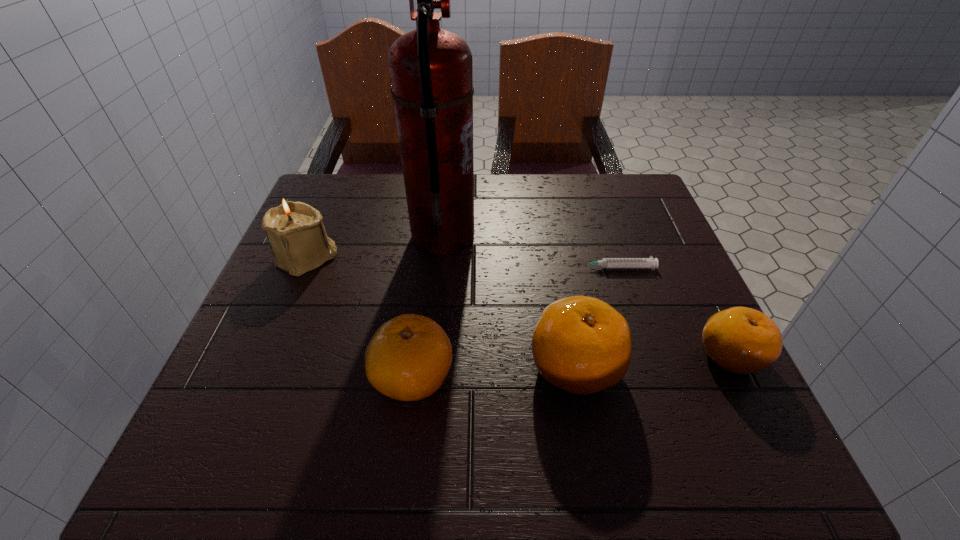
I want to click on vacant region located 0.080m on the left of the second clementine from right to left, so click(x=484, y=366).

The height and width of the screenshot is (540, 960). I want to click on free space located 0.060m on the left of the rightmost object, so click(x=665, y=356).

Locate an element on the screen. The height and width of the screenshot is (540, 960). vacant region located on the nozzle side of the fire extinguisher is located at coordinates (575, 237).

The height and width of the screenshot is (540, 960). I want to click on vacant space located on the back of the fifth shortest object, so click(x=339, y=183).

The height and width of the screenshot is (540, 960). I want to click on vacant space situated at the needle end of the shortest object, so click(x=463, y=268).

Where is `vacant area situated 0.120m at the needle end of the shortest object`? This screenshot has height=540, width=960. vacant area situated 0.120m at the needle end of the shortest object is located at coordinates tap(520, 268).

I want to click on free location located 0.070m at the needle end of the shortest object, so click(543, 268).

The width and height of the screenshot is (960, 540). I want to click on object located at the far edge, so click(431, 74).

Where is `object positioned at the left edge`? The image size is (960, 540). object positioned at the left edge is located at coordinates (295, 231).

What are the coordinates of `clementine present at the right edge` in the screenshot? It's located at (742, 340).